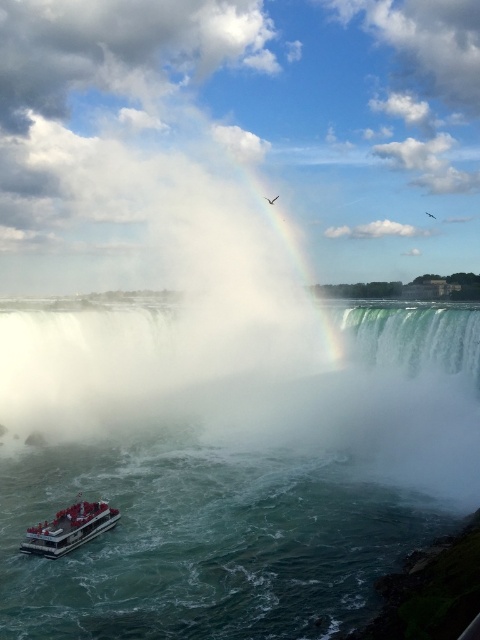
Question: Is clear water at lower left positioned before white plastic boat at lower left?

Choices:
 (A) no
 (B) yes

Answer: (B)

Question: Among these objects, which one is farthest from the camera?

Choices:
 (A) clear water at lower left
 (B) white plastic boat at lower left

Answer: (B)

Question: Is clear water at lower left further to camera compared to white plastic boat at lower left?

Choices:
 (A) yes
 (B) no

Answer: (B)

Question: Among these objects, which one is farthest from the camera?

Choices:
 (A) white plastic boat at lower left
 (B) clear water at lower left

Answer: (A)

Question: Does clear water at lower left lie in front of white plastic boat at lower left?

Choices:
 (A) no
 (B) yes

Answer: (B)

Question: Which point appears closest to the camera in this image?

Choices:
 (A) (54, 532)
 (B) (222, 400)

Answer: (A)